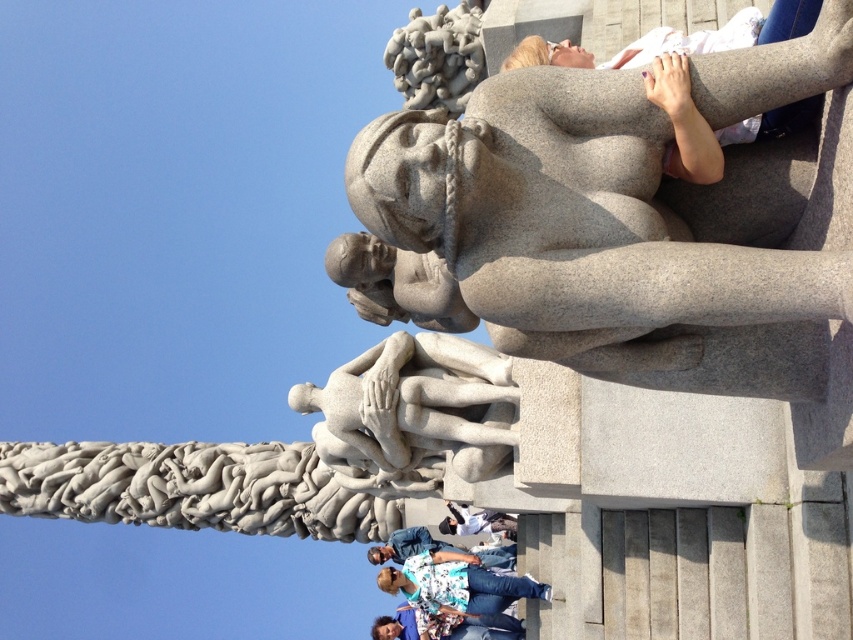
What do you see at coordinates (606, 234) in the screenshot?
I see `gray stone statue at upper center` at bounding box center [606, 234].

Looking at this image, between gray stone statue at upper center and white cotton shirt at lower center, which one has more height?

gray stone statue at upper center is taller.

Measure the distance between gray stone statue at upper center and camera.

gray stone statue at upper center and camera are 100.76 feet apart from each other.

Identify the location of gray stone statue at upper center. This screenshot has height=640, width=853. (606, 234).

Is white stone sculpture at center further to the viewer compared to white cotton shirt at upper center?

No.

Who is lower down, white stone sculpture at center or white cotton shirt at upper center?

white cotton shirt at upper center

At what (x,y) coordinates should I click in order to perform the action: click on white stone sculpture at center. Please return your answer as a coordinate pair (x, y). The height and width of the screenshot is (640, 853). Looking at the image, I should click on (415, 406).

The width and height of the screenshot is (853, 640). What are the coordinates of `white stone sculpture at center` in the screenshot? It's located at (415, 406).

Does gray stone statue at upper center have a greater height compared to white cotton shirt at upper center?

Yes, gray stone statue at upper center is taller than white cotton shirt at upper center.

Between point (537, 256) and point (503, 513), which one is positioned behind?

Point (503, 513)

The width and height of the screenshot is (853, 640). Identify the location of gray stone statue at upper center. (606, 234).